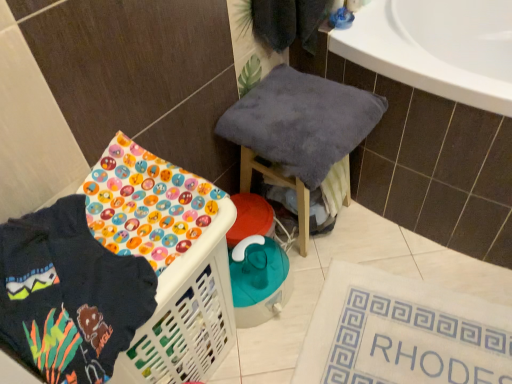
Find the location of a particular element. This screenshot has height=384, width=512. blank space above white fabric bath mat at lower right (from a real-world perspective) is located at coordinates (403, 334).